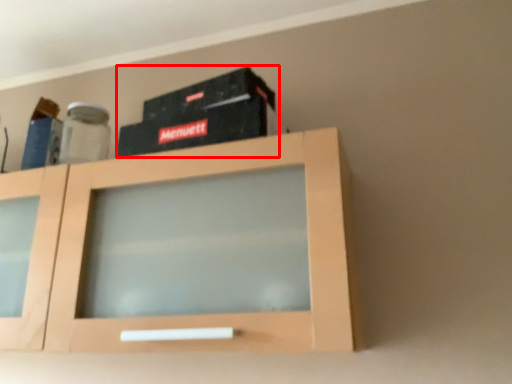
Question: Considering the relative positions of box (annotated by the red box) and cabinetry in the image provided, where is box (annotated by the red box) located with respect to the staircase?

Choices:
 (A) left
 (B) right

Answer: (B)